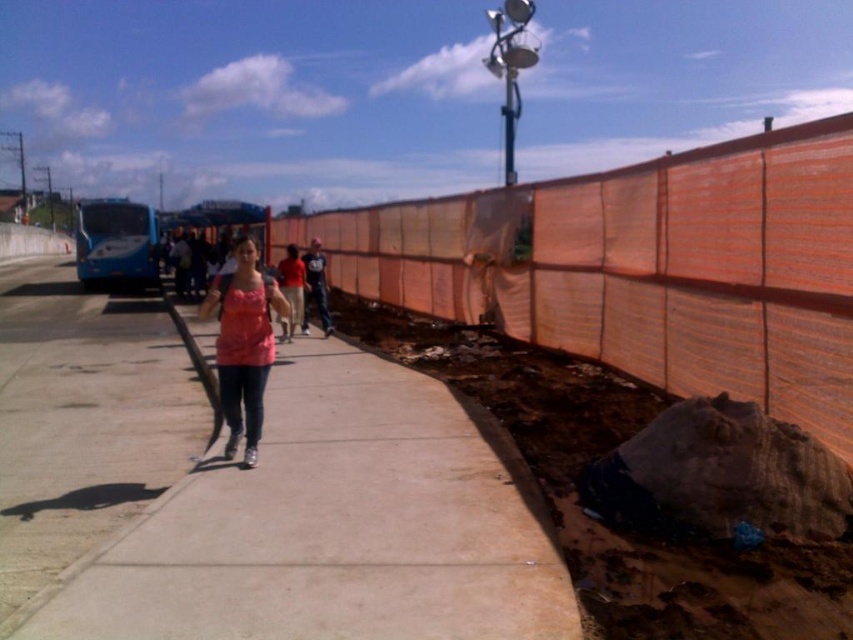
In the scene shown: Is smooth concrete sidewalk at center bigger than pink matte shirt at center?

No, smooth concrete sidewalk at center is not bigger than pink matte shirt at center.

Is smooth concrete sidewalk at center thinner than pink matte shirt at center?

In fact, smooth concrete sidewalk at center might be wider than pink matte shirt at center.

What do you see at coordinates (318, 524) in the screenshot?
I see `smooth concrete sidewalk at center` at bounding box center [318, 524].

This screenshot has width=853, height=640. I want to click on smooth concrete sidewalk at center, so click(x=318, y=524).

Can you confirm if matte pink tank top at center is positioned below pink matte shirt at center?

Yes.

Does matte pink tank top at center have a smaller size compared to pink matte shirt at center?

Indeed, matte pink tank top at center has a smaller size compared to pink matte shirt at center.

Locate an element on the screen. Image resolution: width=853 pixels, height=640 pixels. matte pink tank top at center is located at coordinates (242, 344).

Is orange mesh fence at center closer to the viewer compared to matte pink tank top at center?

Yes.

This screenshot has width=853, height=640. Describe the element at coordinates (643, 268) in the screenshot. I see `orange mesh fence at center` at that location.

Does point (701, 368) come in front of point (258, 390)?

That is False.

Image resolution: width=853 pixels, height=640 pixels. Identify the location of orange mesh fence at center. (643, 268).